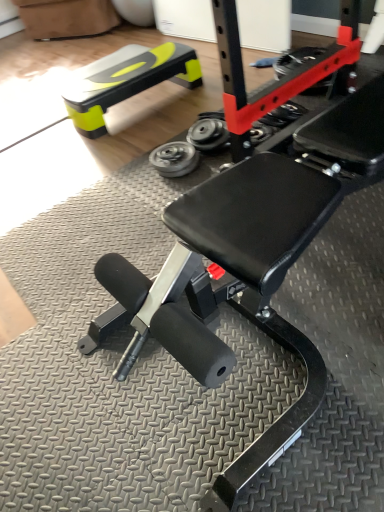
From the picture: Measure the distance between metallic silver wheel at center, which is the 2th wheel from right to left, and camera.

The distance of metallic silver wheel at center, which is the 2th wheel from right to left, from camera is 6.13 feet.

You are a GUI agent. You are given a task and a screenshot of the screen. Output one action in this format:
    pyautogui.click(x=<x>, y=<y>)
    Task: Click on the metallic gray wheel at center, the 2th wheel viewed from the left
    The width and height of the screenshot is (384, 512).
    Given the screenshot: What is the action you would take?
    click(208, 134)

What do you see at coordinates (296, 59) in the screenshot? The image size is (384, 512). I see `rubber/soft tire at center` at bounding box center [296, 59].

This screenshot has height=512, width=384. Find the location of `metallic silver wheel at center, placed as the first wheel when sorted from left to right`. metallic silver wheel at center, placed as the first wheel when sorted from left to right is located at coordinates (174, 159).

Is metallic silver wheel at center, placed as the first wheel when sorted from left to right, in front of neon yellow plastic bench at upper left?

Yes, the depth of metallic silver wheel at center, placed as the first wheel when sorted from left to right, is less than that of neon yellow plastic bench at upper left.

Is metallic silver wheel at center, which is the 2th wheel from right to left, positioned far away from neon yellow plastic bench at upper left?

No.

Considering the sizes of objects metallic silver wheel at center, which is the 2th wheel from right to left, and neon yellow plastic bench at upper left in the image provided, who is wider, metallic silver wheel at center, which is the 2th wheel from right to left, or neon yellow plastic bench at upper left?

neon yellow plastic bench at upper left is wider.

The width and height of the screenshot is (384, 512). What are the coordinates of `the 2nd wheel in front of the neon yellow plastic bench at upper left, counting from the anchor's position` in the screenshot? It's located at (174, 159).

Considering the relative sizes of metallic silver wheel at center, placed as the first wheel when sorted from left to right, and metallic gray wheel at center, the 2th wheel viewed from the left, in the image provided, is metallic silver wheel at center, placed as the first wheel when sorted from left to right, bigger than metallic gray wheel at center, the 2th wheel viewed from the left,?

No.

Based on the photo, from the image's perspective, does metallic silver wheel at center, which is the 2th wheel from right to left, appear lower than metallic gray wheel at center, the 2th wheel viewed from the left?

Yes.

Considering the positions of objects metallic silver wheel at center, placed as the first wheel when sorted from left to right, and metallic gray wheel at center, the 2th wheel viewed from the left, in the image provided, who is more to the left, metallic silver wheel at center, placed as the first wheel when sorted from left to right, or metallic gray wheel at center, the 2th wheel viewed from the left,?

Positioned to the left is metallic silver wheel at center, placed as the first wheel when sorted from left to right.

How distant is rubber/soft tire at center from metallic gray wheel at center, the 2th wheel viewed from the left?

rubber/soft tire at center and metallic gray wheel at center, the 2th wheel viewed from the left, are 30.48 inches apart.

Could you tell me if rubber/soft tire at center is facing metallic gray wheel at center, the 1th wheel positioned from the right?

Yes, rubber/soft tire at center is oriented towards metallic gray wheel at center, the 1th wheel positioned from the right.

In the scene shown: From a real-world perspective, is rubber/soft tire at center on metallic gray wheel at center, the 2th wheel viewed from the left?

Yes, from a real-world perspective, rubber/soft tire at center is on top of metallic gray wheel at center, the 2th wheel viewed from the left.

Which is nearer, (228, 138) or (135, 84)?

Point (228, 138).

Consider the image. From the image's perspective, is metallic gray wheel at center, the 1th wheel positioned from the right, over neon yellow plastic bench at upper left?

No, from the image's perspective, metallic gray wheel at center, the 1th wheel positioned from the right, is not over neon yellow plastic bench at upper left.

In the image, is metallic gray wheel at center, the 1th wheel positioned from the right, positioned in front of or behind neon yellow plastic bench at upper left?

Visually, metallic gray wheel at center, the 1th wheel positioned from the right, is located in front of neon yellow plastic bench at upper left.

Does rubber/soft tire at center have a greater height compared to metallic silver wheel at center, placed as the first wheel when sorted from left to right?

Yes.

Is point (298, 55) closer to viewer compared to point (162, 160)?

No, (298, 55) is behind (162, 160).

Is rubber/soft tire at center to the left of metallic silver wheel at center, placed as the first wheel when sorted from left to right, from the viewer's perspective?

No, rubber/soft tire at center is not to the left of metallic silver wheel at center, placed as the first wheel when sorted from left to right.

Which of these two, rubber/soft tire at center or metallic silver wheel at center, which is the 2th wheel from right to left, is wider?

Wider between the two is rubber/soft tire at center.

Is neon yellow plastic bench at upper left to the left of rubber/soft tire at center from the viewer's perspective?

Indeed, neon yellow plastic bench at upper left is positioned on the left side of rubber/soft tire at center.

Which object is thinner, neon yellow plastic bench at upper left or rubber/soft tire at center?

Thinner between the two is rubber/soft tire at center.

From the image's perspective, which is below, neon yellow plastic bench at upper left or rubber/soft tire at center?

From the image's view, neon yellow plastic bench at upper left is below.

Is rubber/soft tire at center located outside neon yellow plastic bench at upper left?

Yes, rubber/soft tire at center is not within neon yellow plastic bench at upper left.

Considering the positions of points (296, 50) and (174, 77), is point (296, 50) closer to camera compared to point (174, 77)?

No.

Which object is further away from the camera taking this photo, rubber/soft tire at center or neon yellow plastic bench at upper left?

neon yellow plastic bench at upper left is further away from the camera.

Is rubber/soft tire at center not near neon yellow plastic bench at upper left?

rubber/soft tire at center is actually quite close to neon yellow plastic bench at upper left.

Find the location of a particular element. Image resolution: width=384 pixels, height=512 pixels. bench lying on the left of metallic silver wheel at center, placed as the first wheel when sorted from left to right is located at coordinates (128, 84).

This screenshot has width=384, height=512. In order to click on wheel in front of the metallic gray wheel at center, the 2th wheel viewed from the left in this screenshot , I will do `click(174, 159)`.

Based on their spatial positions, is rubber/soft tire at center or neon yellow plastic bench at upper left closer to metallic silver wheel at center, which is the 2th wheel from right to left?

neon yellow plastic bench at upper left is closer to metallic silver wheel at center, which is the 2th wheel from right to left.

Looking at the image, which one is located closer to neon yellow plastic bench at upper left, metallic gray wheel at center, the 1th wheel positioned from the right, or metallic silver wheel at center, which is the 2th wheel from right to left?

The object closer to neon yellow plastic bench at upper left is metallic gray wheel at center, the 1th wheel positioned from the right.

Which object lies further to the anchor point neon yellow plastic bench at upper left, metallic silver wheel at center, which is the 2th wheel from right to left, or metallic gray wheel at center, the 1th wheel positioned from the right?

metallic silver wheel at center, which is the 2th wheel from right to left, is positioned further to the anchor neon yellow plastic bench at upper left.

From the image, which object appears to be nearer to rubber/soft tire at center, metallic gray wheel at center, the 1th wheel positioned from the right, or metallic silver wheel at center, placed as the first wheel when sorted from left to right?

metallic gray wheel at center, the 1th wheel positioned from the right, lies closer to rubber/soft tire at center than the other object.

When comparing their distances from rubber/soft tire at center, does metallic silver wheel at center, placed as the first wheel when sorted from left to right, or neon yellow plastic bench at upper left seem closer?

neon yellow plastic bench at upper left.

From the image, which object appears to be farther from neon yellow plastic bench at upper left, metallic silver wheel at center, placed as the first wheel when sorted from left to right, or rubber/soft tire at center?

The object further to neon yellow plastic bench at upper left is rubber/soft tire at center.

When comparing their distances from rubber/soft tire at center, does metallic gray wheel at center, the 2th wheel viewed from the left, or neon yellow plastic bench at upper left seem closer?

metallic gray wheel at center, the 2th wheel viewed from the left, lies closer to rubber/soft tire at center than the other object.

Considering their positions, is metallic silver wheel at center, which is the 2th wheel from right to left, positioned closer to metallic gray wheel at center, the 1th wheel positioned from the right, than neon yellow plastic bench at upper left?

metallic silver wheel at center, which is the 2th wheel from right to left, is closer to metallic gray wheel at center, the 1th wheel positioned from the right.

You are a GUI agent. You are given a task and a screenshot of the screen. Output one action in this format:
    pyautogui.click(x=<x>, y=<y>)
    Task: Click on the wheel between metallic silver wheel at center, which is the 2th wheel from right to left, and rubber/soft tire at center from left to right
    This screenshot has height=512, width=384.
    Given the screenshot: What is the action you would take?
    pyautogui.click(x=208, y=134)

Where is `wheel that lies between neon yellow plastic bench at upper left and metallic silver wheel at center, placed as the first wheel when sorted from left to right, from top to bottom`? This screenshot has height=512, width=384. wheel that lies between neon yellow plastic bench at upper left and metallic silver wheel at center, placed as the first wheel when sorted from left to right, from top to bottom is located at coordinates (208, 134).